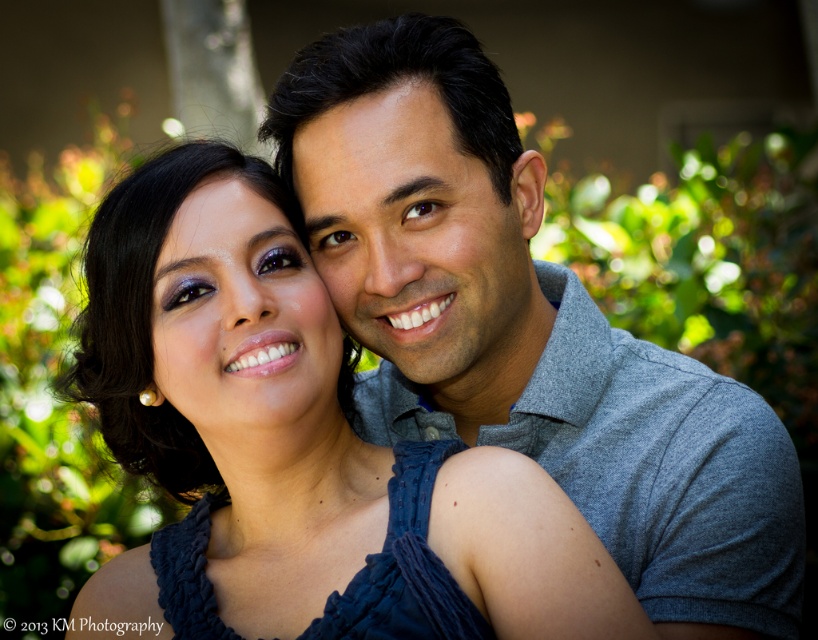
Question: Which object is the farthest from the gray cotton shirt at upper right?

Choices:
 (A) matte purple eye shadow at center
 (B) smooth skin face at center

Answer: (A)

Question: Which of the following is the farthest from the observer?

Choices:
 (A) gray cotton shirt at upper right
 (B) matte blue dress at center
 (C) matte purple eye shadow at center
 (D) smooth skin face at center

Answer: (D)

Question: Is the position of gray cotton shirt at upper right more distant than that of matte purple eye shadow at center?

Choices:
 (A) yes
 (B) no

Answer: (A)

Question: Is matte blue dress at center to the right of gray cotton shirt at upper right from the viewer's perspective?

Choices:
 (A) yes
 (B) no

Answer: (B)

Question: Does gray cotton shirt at upper right appear on the right side of matte purple eye shadow at center?

Choices:
 (A) yes
 (B) no

Answer: (A)

Question: Which point is farther to the camera?

Choices:
 (A) (201, 220)
 (B) (452, 202)
 (C) (437, 268)

Answer: (C)